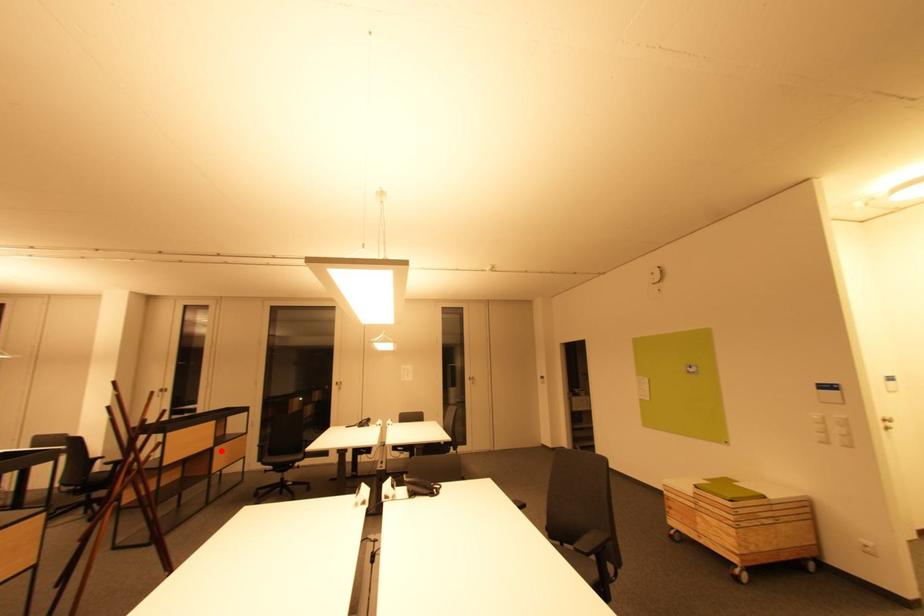
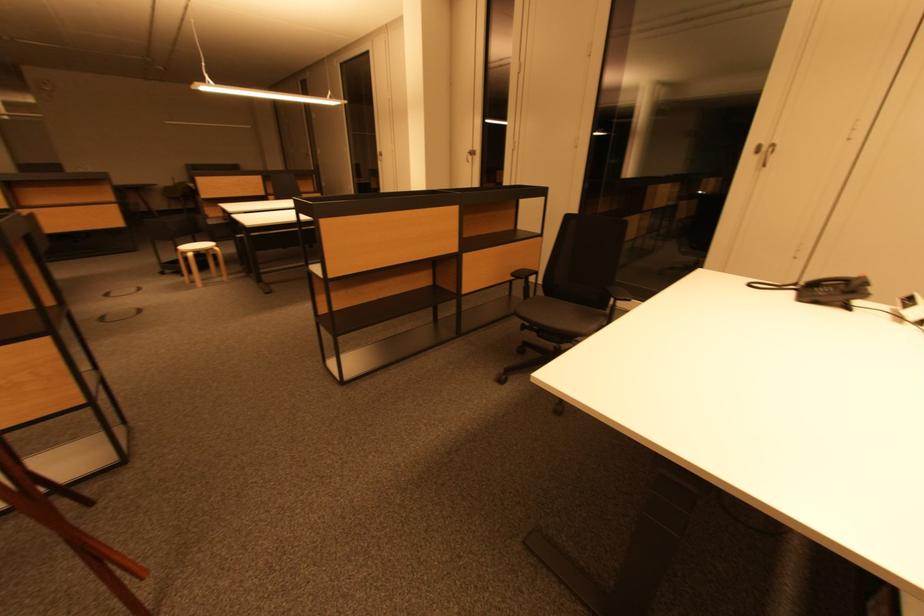
Find the pixel in the second image that matches the highlighted location in the first image.

(470, 259)